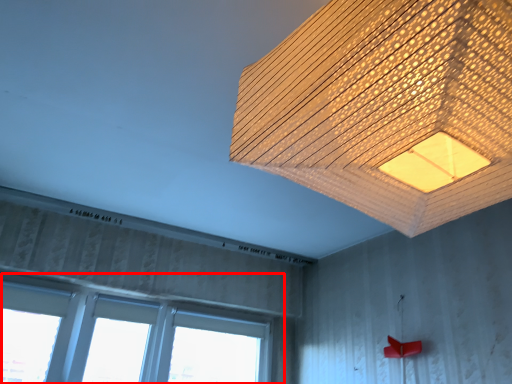
Question: In this image, where is window (annotated by the red box) located relative to lamp?

Choices:
 (A) left
 (B) right

Answer: (A)